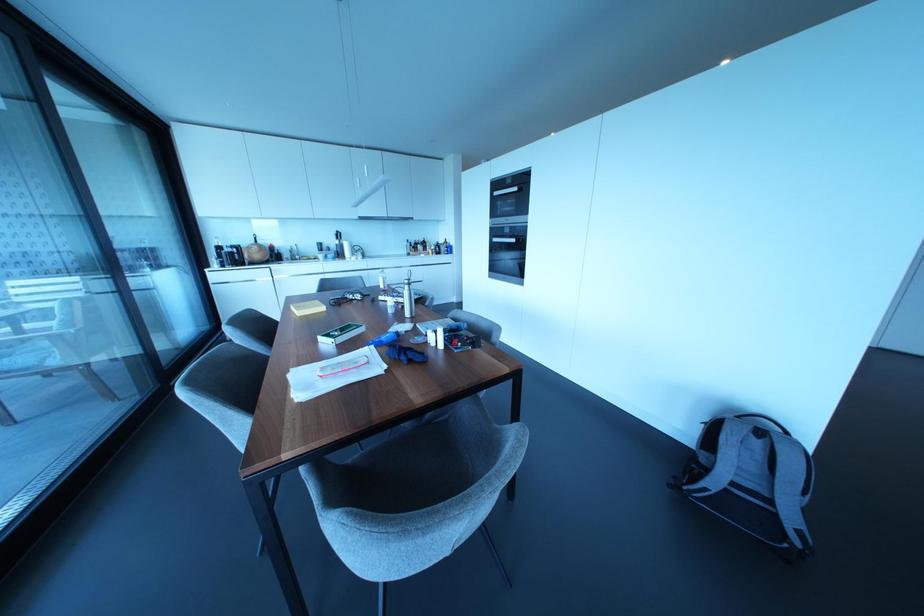
Where would you sit the grey chair sitting surface? Please return your answer as a coordinate pair (x, y).

(407, 472)